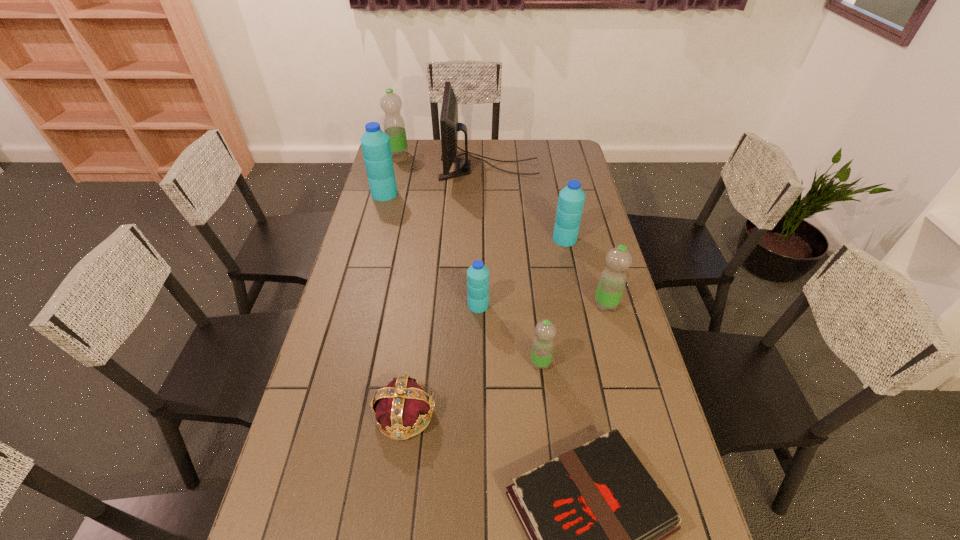
Locate which object is the second closest to the third farthest water bottle. Please provide its 2D coordinates. Your answer should be formatted as a tuple, i.e. [(x, y)], where the tuple contains the x and y coordinates of a point satisfying the conditions above.

[(449, 126)]

You are a GUI agent. You are given a task and a screenshot of the screen. Output one action in this format:
    pyautogui.click(x=<x>, y=<y>)
    Task: Click on the object that is the fifth closest to the eighth tallest object
    
    Given the screenshot: What is the action you would take?
    pyautogui.click(x=571, y=200)

Locate which water bottle is the closest to the third water bottle from right to left. Please provide its 2D coordinates. Your answer should be formatted as a tuple, i.e. [(x, y)], where the tuple contains the x and y coordinates of a point satisfying the conditions above.

[(478, 274)]

Find the location of `water bottle that is the nearest to the farthest water bottle`. water bottle that is the nearest to the farthest water bottle is located at coordinates (375, 143).

Where is `green water bottle that can be found as the closest to the nearest water bottle`? This screenshot has height=540, width=960. green water bottle that can be found as the closest to the nearest water bottle is located at coordinates (612, 281).

Identify which green water bottle is the second closest to the second blue water bottle from right to left. Please provide its 2D coordinates. Your answer should be formatted as a tuple, i.e. [(x, y)], where the tuple contains the x and y coordinates of a point satisfying the conditions above.

[(612, 281)]

Where is `blue water bottle object that ranks as the second closest to the biggest blue water bottle`? Image resolution: width=960 pixels, height=540 pixels. blue water bottle object that ranks as the second closest to the biggest blue water bottle is located at coordinates (571, 200).

Identify the location of the second closest blue water bottle to the shortest object. (571, 200).

At what (x,y) coordinates should I click in order to perform the action: click on free space that satisfies the following two spatial constraints: 1. on the back side of the second farthest blue water bottle; 2. on the right side of the second shortest object. Please return your answer as a coordinate pair (x, y). The width and height of the screenshot is (960, 540). Looking at the image, I should click on (428, 239).

Find the location of a particular element. free space in the image that satisfies the following two spatial constraints: 1. on the back side of the second blue water bottle from left to right; 2. on the left side of the rightmost blue water bottle is located at coordinates (478, 239).